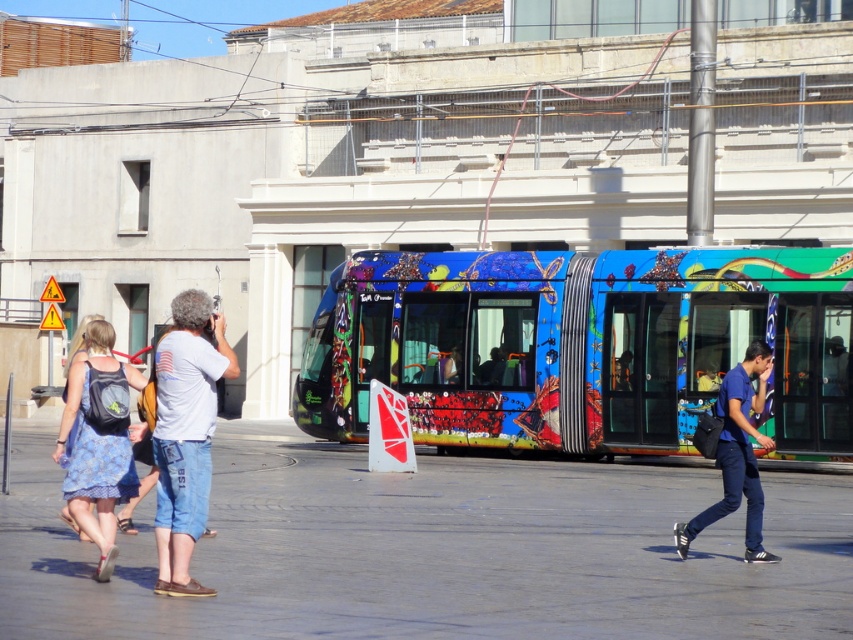
Question: Does white cotton shirt at center have a smaller size compared to blue floral dress at lower left?

Choices:
 (A) yes
 (B) no

Answer: (B)

Question: Among these points, which one is nearest to the camera?

Choices:
 (A) (747, 496)
 (B) (646, 577)

Answer: (B)

Question: Can you confirm if white cotton shirt at center is positioned to the left of blue cotton shirt at center?

Choices:
 (A) no
 (B) yes

Answer: (B)

Question: Among these objects, which one is farthest from the camera?

Choices:
 (A) smooth concrete pavement at center
 (B) multicolored painted bus at center
 (C) white cotton shirt at center

Answer: (B)

Question: Based on their relative distances, which object is farther from the blue floral dress at lower left?

Choices:
 (A) multicolored painted bus at center
 (B) white cotton shirt at center
 (C) blue cotton shirt at center

Answer: (A)

Question: Can you confirm if smooth concrete pavement at center is smaller than multicolored painted bus at center?

Choices:
 (A) no
 (B) yes

Answer: (A)